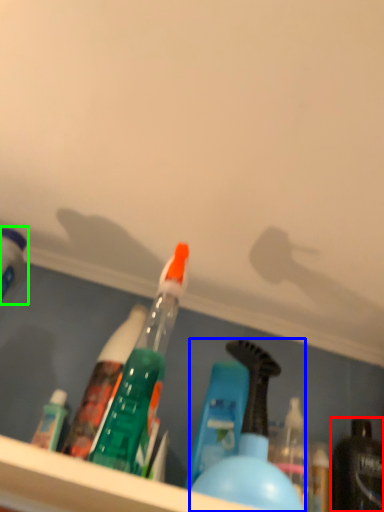
Question: Which object is positioned farthest from bottle (highlighted by a red box)? Select from bottle (highlighted by a blue box) and bottle (highlighted by a green box).

Choices:
 (A) bottle
 (B) bottle

Answer: (B)